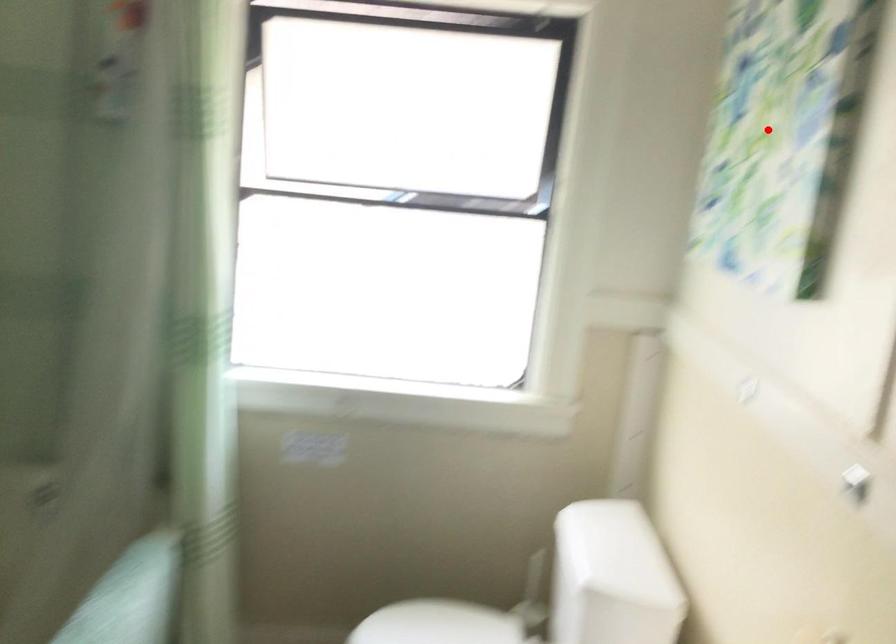
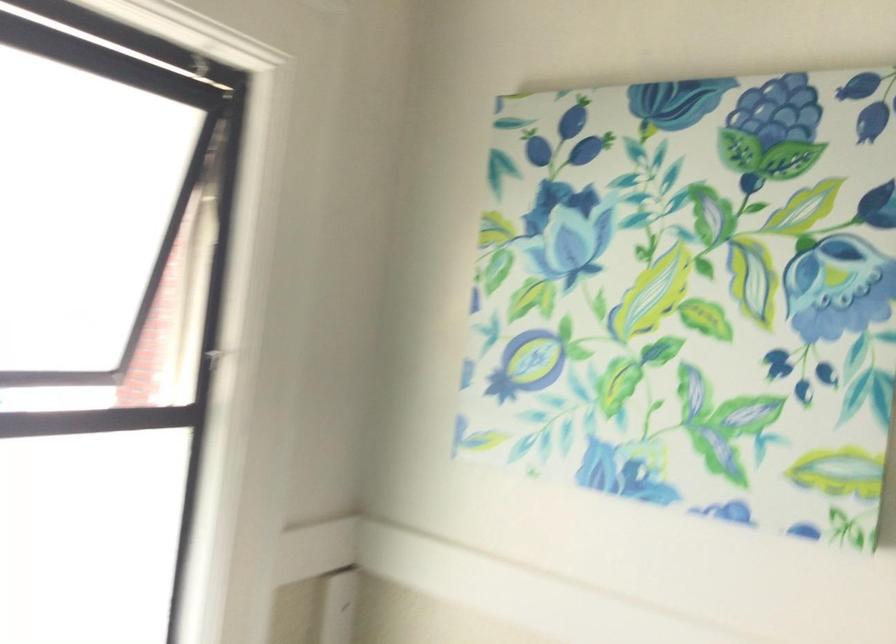
Question: I am providing you with two images of the same scene from different viewpoints. Given a red point in image1, look at the same physical point in image2. Is it:

Choices:
 (A) Closer to the viewpoint
 (B) Farther from the viewpoint

Answer: (A)